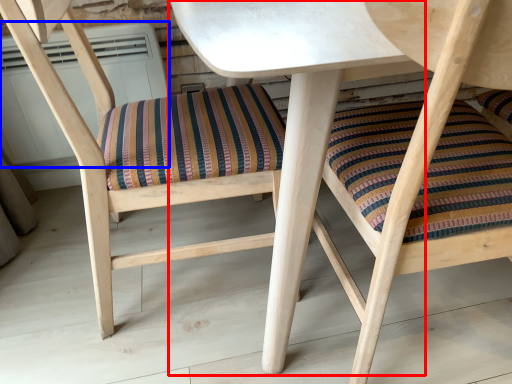
Question: Among these objects, which one is nearest to the camera, table (highlighted by a red box) or air conditioner (highlighted by a blue box)?

Choices:
 (A) table
 (B) air conditioner

Answer: (A)